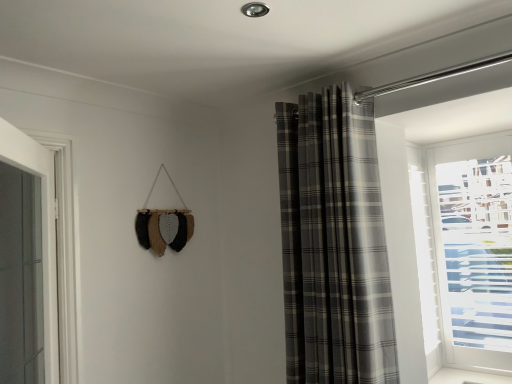
Image resolution: width=512 pixels, height=384 pixels. I want to click on white glossy door at left, so click(x=42, y=228).

Describe the element at coordinates (42, 228) in the screenshot. I see `white glossy door at left` at that location.

What do you see at coordinates (333, 243) in the screenshot? I see `plaid fabric curtain at upper right` at bounding box center [333, 243].

Image resolution: width=512 pixels, height=384 pixels. In order to click on plaid fabric curtain at upper right in this screenshot , I will do `click(333, 243)`.

Locate an element on the screen. Image resolution: width=512 pixels, height=384 pixels. white glossy door at left is located at coordinates (42, 228).

Would you say white glossy door at left is to the left or to the right of plaid fabric curtain at upper right in the picture?

white glossy door at left is positioned on plaid fabric curtain at upper right's left side.

Relative to plaid fabric curtain at upper right, is white glossy door at left in front or behind?

Clearly, white glossy door at left is in front of plaid fabric curtain at upper right.

Considering the positions of points (4, 144) and (328, 157), is point (4, 144) closer to camera compared to point (328, 157)?

Yes, point (4, 144) is closer to viewer.

From the image's perspective, is white glossy door at left on top of plaid fabric curtain at upper right?

No, from the image's perspective, white glossy door at left is not over plaid fabric curtain at upper right.

From a real-world perspective, who is located lower, white glossy door at left or plaid fabric curtain at upper right?

white glossy door at left is physically lower.

Is white glossy door at left wider or thinner than plaid fabric curtain at upper right?

Considering their sizes, white glossy door at left looks slimmer than plaid fabric curtain at upper right.

Which of these two, white glossy door at left or plaid fabric curtain at upper right, stands taller?

plaid fabric curtain at upper right is taller.

Considering the sizes of objects white glossy door at left and plaid fabric curtain at upper right in the image provided, who is bigger, white glossy door at left or plaid fabric curtain at upper right?

With larger size is plaid fabric curtain at upper right.

Is white glossy door at left not inside plaid fabric curtain at upper right?

Absolutely, white glossy door at left is external to plaid fabric curtain at upper right.

Is white glossy door at left not close to plaid fabric curtain at upper right?

Yes, white glossy door at left and plaid fabric curtain at upper right are quite far apart.

Is white glossy door at left oriented away from plaid fabric curtain at upper right?

Yes, white glossy door at left is facing away from plaid fabric curtain at upper right.

Locate an element on the screen. The height and width of the screenshot is (384, 512). door in front of the plaid fabric curtain at upper right is located at coordinates (42, 228).

Considering the positions of objects plaid fabric curtain at upper right and white glossy door at left in the image provided, who is more to the left, plaid fabric curtain at upper right or white glossy door at left?

Positioned to the left is white glossy door at left.

Is plaid fabric curtain at upper right closer to camera compared to white glossy door at left?

No, plaid fabric curtain at upper right is further to the viewer.

Looking at this image, which point is more distant from viewer, (347, 112) or (42, 260)?

The point (347, 112) is more distant.

From the image's perspective, between plaid fabric curtain at upper right and white glossy door at left, which one is located above?

plaid fabric curtain at upper right, from the image's perspective.

From a real-world perspective, is plaid fabric curtain at upper right above or below white glossy door at left?

plaid fabric curtain at upper right is above white glossy door at left.

Looking at their sizes, would you say plaid fabric curtain at upper right is wider or thinner than white glossy door at left?

Considering their sizes, plaid fabric curtain at upper right looks broader than white glossy door at left.

Between plaid fabric curtain at upper right and white glossy door at left, which one has less height?

Standing shorter between the two is white glossy door at left.

Considering the relative sizes of plaid fabric curtain at upper right and white glossy door at left in the image provided, is plaid fabric curtain at upper right bigger than white glossy door at left?

Indeed, plaid fabric curtain at upper right has a larger size compared to white glossy door at left.

Choose the correct answer: Is plaid fabric curtain at upper right inside white glossy door at left or outside it?

plaid fabric curtain at upper right is located beyond the bounds of white glossy door at left.

Would you consider plaid fabric curtain at upper right to be distant from white glossy door at left?

Yes, plaid fabric curtain at upper right and white glossy door at left are located far from each other.

In the scene shown: Could you tell me if plaid fabric curtain at upper right is turned towards white glossy door at left?

Yes, plaid fabric curtain at upper right is facing white glossy door at left.

Can you tell me how much plaid fabric curtain at upper right and white glossy door at left differ in facing direction?

There is a 35.5-degree angle between the facing directions of plaid fabric curtain at upper right and white glossy door at left.

The height and width of the screenshot is (384, 512). In order to click on door in front of the plaid fabric curtain at upper right in this screenshot , I will do (x=42, y=228).

This screenshot has width=512, height=384. I want to click on door on the left side of plaid fabric curtain at upper right, so [42, 228].

Image resolution: width=512 pixels, height=384 pixels. I want to click on curtain above the white glossy door at left (from the image's perspective), so click(x=333, y=243).